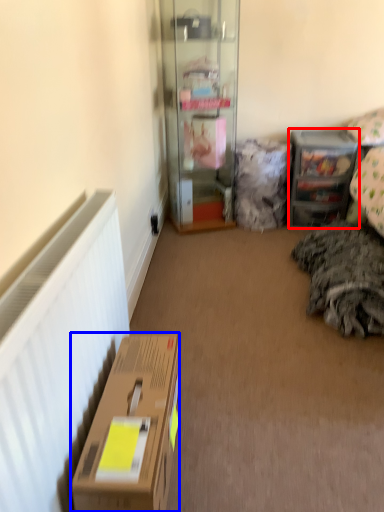
Question: Which object is closer to the camera taking this photo, shelf (highlighted by a red box) or box (highlighted by a blue box)?

Choices:
 (A) shelf
 (B) box

Answer: (B)